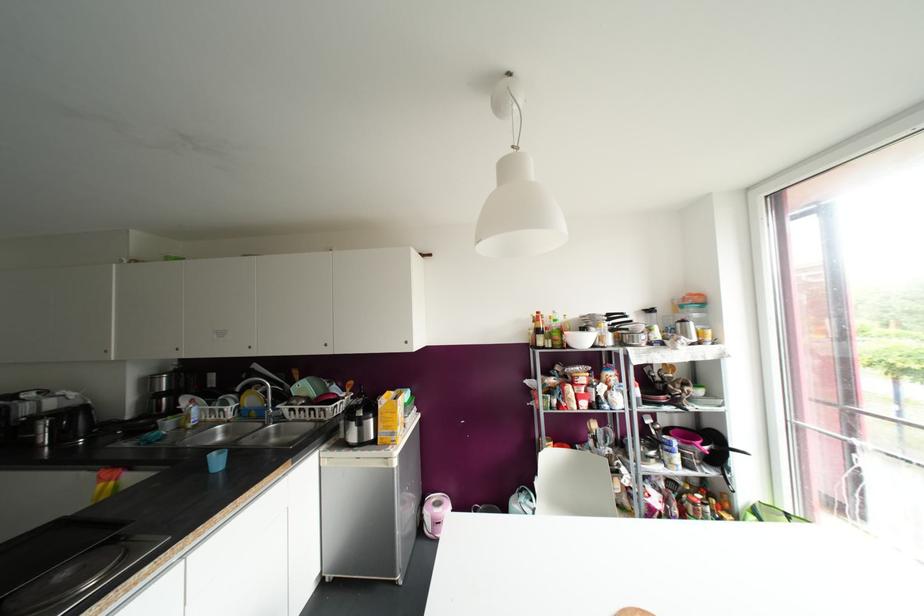
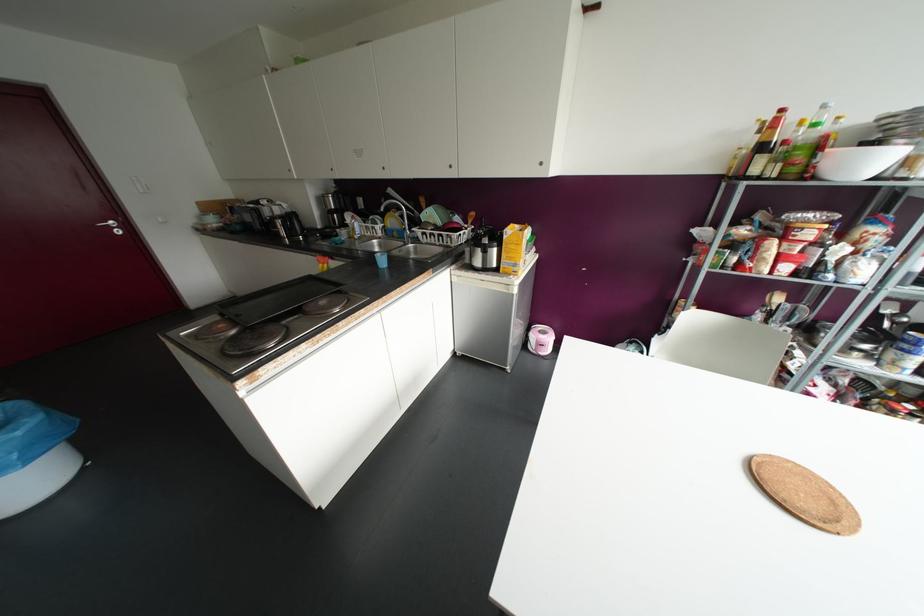
The point at (216, 462) is marked in the first image. Where is the corresponding point in the second image?

(382, 261)